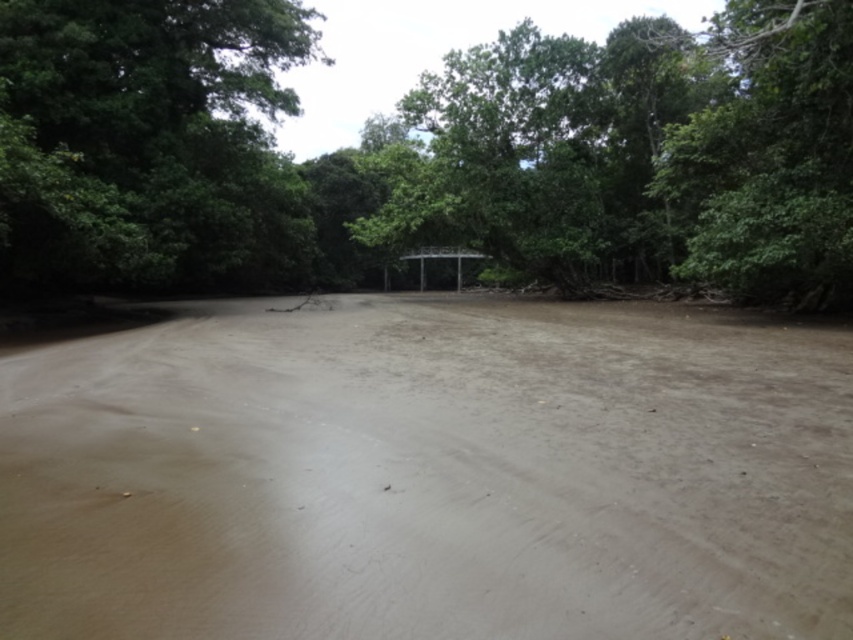
Which is more to the right, green leafy tree at center or green leafy tree at upper left?

green leafy tree at center is more to the right.

Is green leafy tree at center wider than green leafy tree at upper left?

Correct, the width of green leafy tree at center exceeds that of green leafy tree at upper left.

Does point (189, 204) come closer to viewer compared to point (241, 244)?

Yes, point (189, 204) is closer to viewer.

Identify the location of green leafy tree at center. This screenshot has height=640, width=853. (428, 150).

Who is lower down, brown muddy dirt track at center or green leafy tree at center?

Positioned lower is brown muddy dirt track at center.

Who is positioned more to the left, brown muddy dirt track at center or green leafy tree at center?

brown muddy dirt track at center

Is point (577, 419) farther from camera compared to point (467, 52)?

No.

At what (x,y) coordinates should I click in order to perform the action: click on brown muddy dirt track at center. Please return your answer as a coordinate pair (x, y). Looking at the image, I should click on (428, 476).

Who is taller, brown muddy dirt track at center or green leafy tree at upper left?

green leafy tree at upper left is taller.

What do you see at coordinates (428, 476) in the screenshot? I see `brown muddy dirt track at center` at bounding box center [428, 476].

Identify the location of brown muddy dirt track at center. (428, 476).